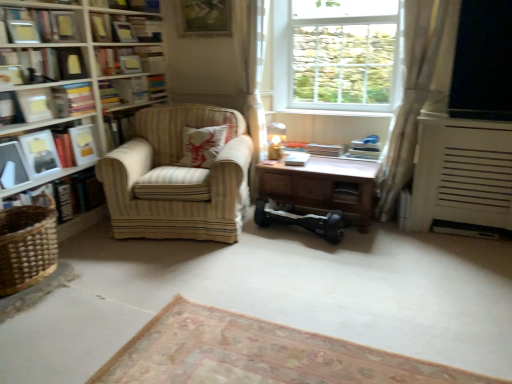
Question: Is brown wooden table at center bigger or smaller than wooden picture frame at upper center?

Choices:
 (A) big
 (B) small

Answer: (A)

Question: From the image's perspective, relative to wooden picture frame at upper center, is brown wooden table at center above or below?

Choices:
 (A) above
 (B) below

Answer: (B)

Question: Estimate the real-world distances between objects in this image. Which object is closer to the matte black photo frame at left, the 1th paperback book viewed from the left?

Choices:
 (A) transparent glass window screen at upper right
 (B) striped fabric armchair at left
 (C) wooden picture frame at upper center
 (D) carpeted floor at lower center, arranged as the first plain when viewed from the back
 (E) brown wooden table at center

Answer: (B)

Question: Based on their relative distances, which object is farther from the woven brown basket at lower left?

Choices:
 (A) wooden picture frame at upper center
 (B) striped fabric armchair at left
 (C) white wooden window at upper center
 (D) wooden at upper center
 (E) matte black book at upper left, which ranks as the 6th book in right-to-left order

Answer: (C)